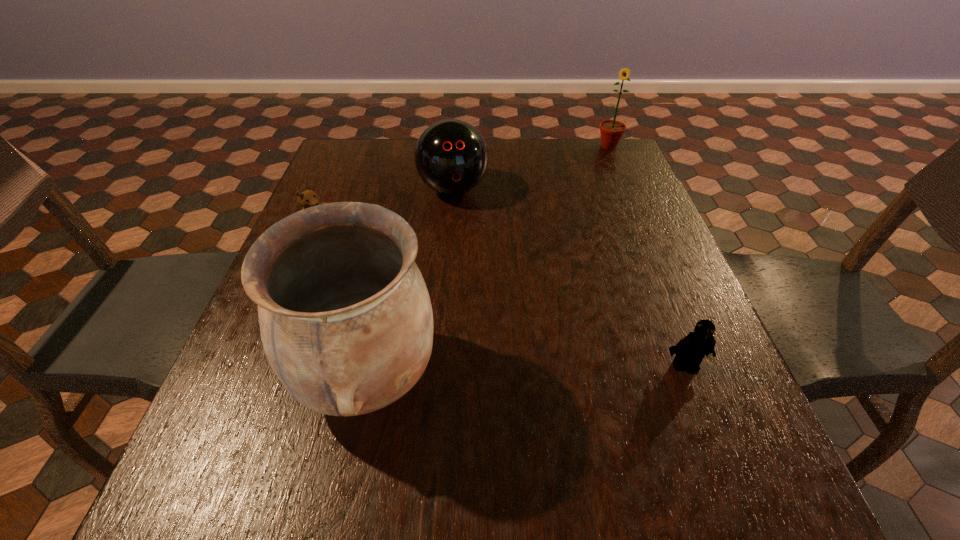
You are a GUI agent. You are given a task and a screenshot of the screen. Output one action in this format:
    pyautogui.click(x=<x>, y=<y>)
    Task: Click on the tallest object
    
    Given the screenshot: What is the action you would take?
    pyautogui.click(x=346, y=322)

At what (x,y) coordinates should I click in order to perform the action: click on Lego. Please return your answer as a coordinate pair (x, y). The image size is (960, 540). Looking at the image, I should click on (690, 350).

Where is `bowling ball`? This screenshot has height=540, width=960. bowling ball is located at coordinates (451, 156).

Locate an element on the screen. the second farthest object is located at coordinates (451, 156).

Locate an element on the screen. The width and height of the screenshot is (960, 540). the leftmost object is located at coordinates (308, 198).

The height and width of the screenshot is (540, 960). In order to click on the third nearest object in this screenshot , I will do pos(308,198).

The height and width of the screenshot is (540, 960). What are the coordinates of `the second tallest object` in the screenshot? It's located at (611, 131).

At what (x,y) coordinates should I click in order to perform the action: click on the farthest object. Please return your answer as a coordinate pair (x, y). This screenshot has height=540, width=960. Looking at the image, I should click on (611, 131).

Where is `free space located on the right of the urn`? The width and height of the screenshot is (960, 540). free space located on the right of the urn is located at coordinates (500, 376).

Locate an element on the screen. This screenshot has height=540, width=960. vacant space located on the face of the Lego is located at coordinates (704, 413).